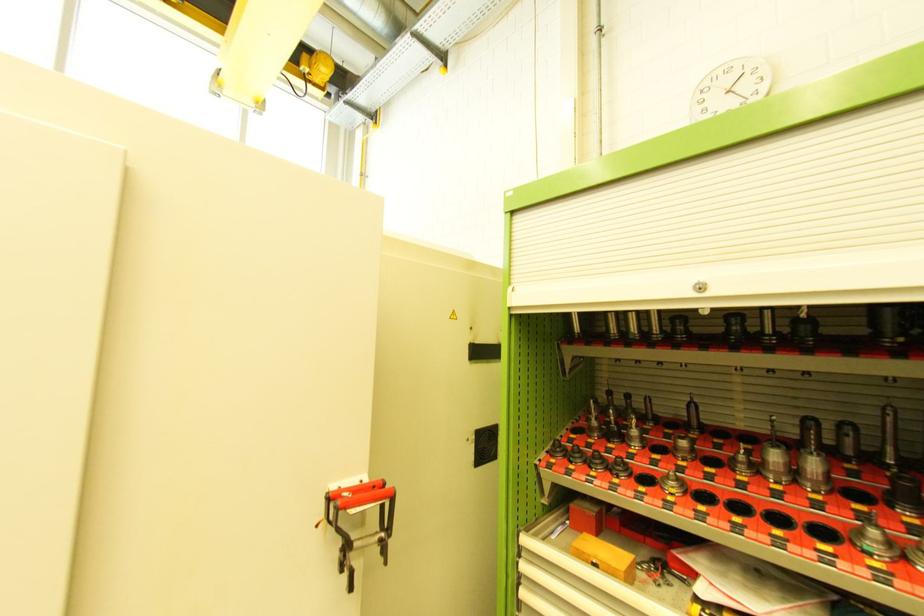
The image size is (924, 616). I want to click on red clamp handle, so click(x=362, y=496).